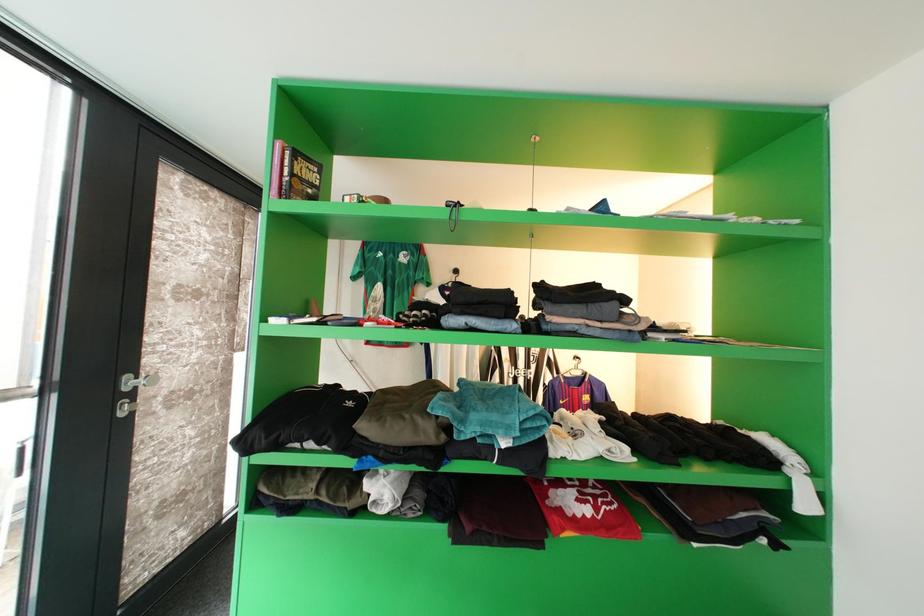
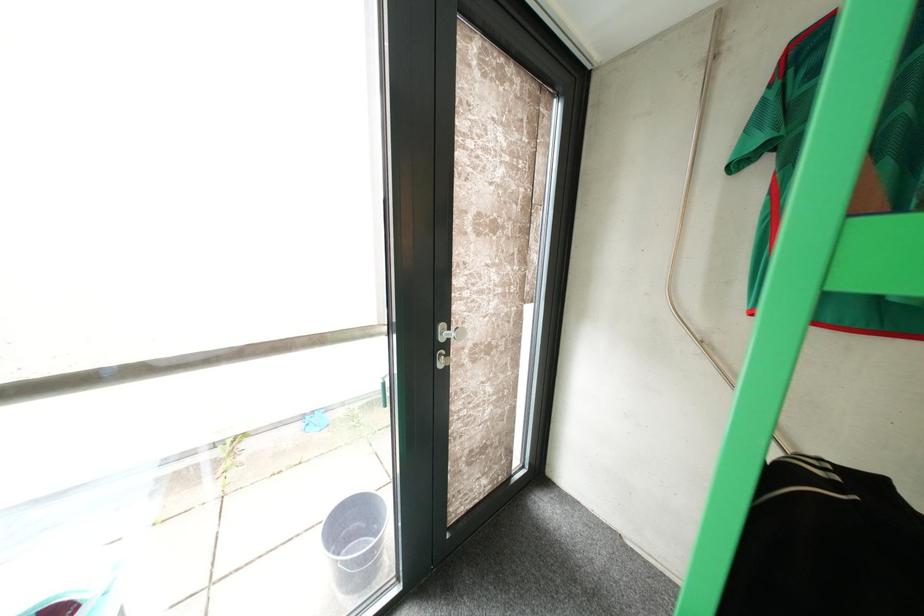
Question: The camera is either moving clockwise (left) or counter-clockwise (right) around the object. The first image is from the beginning of the video and the second image is from the end. Is the camera moving left or right when shooting the video?

Choices:
 (A) Left
 (B) Right

Answer: (B)